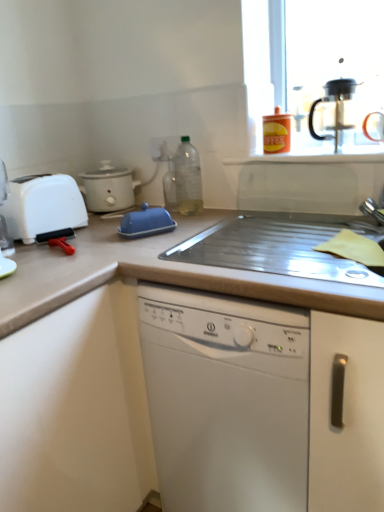
Question: Can beige laminate countertop at center, which is the 1th countertop in bottom-to-top order, be found inside black plastic coffee machine at upper right?

Choices:
 (A) no
 (B) yes

Answer: (A)

Question: Can you confirm if black plastic coffee machine at upper right is positioned to the left of beige laminate countertop at center, which appears as the 2th countertop when viewed from the top?

Choices:
 (A) no
 (B) yes

Answer: (A)

Question: Does black plastic coffee machine at upper right have a larger size compared to beige laminate countertop at center, which appears as the 2th countertop when viewed from the top?

Choices:
 (A) yes
 (B) no

Answer: (B)

Question: Can you confirm if black plastic coffee machine at upper right is shorter than beige laminate countertop at center, which is the 1th countertop in bottom-to-top order?

Choices:
 (A) yes
 (B) no

Answer: (A)

Question: Does black plastic coffee machine at upper right appear on the right side of beige laminate countertop at center, which is the 1th countertop in bottom-to-top order?

Choices:
 (A) no
 (B) yes

Answer: (B)

Question: Considering the positions of point (125, 170) and point (135, 269), is point (125, 170) closer or farther from the camera than point (135, 269)?

Choices:
 (A) closer
 (B) farther

Answer: (B)

Question: In the image, is white matte slow cooker at left, marked as the first kitchen appliance in a back-to-front arrangement, positioned in front of or behind metallic silver sink at center, which is the 2th countertop in bottom-to-top order?

Choices:
 (A) behind
 (B) front

Answer: (A)

Question: From the image's perspective, is white matte slow cooker at left, which ranks as the first kitchen appliance in left-to-right order, positioned above or below metallic silver sink at center, acting as the 1th countertop starting from the top?

Choices:
 (A) below
 (B) above

Answer: (B)

Question: Considering the positions of white matte slow cooker at left, the third kitchen appliance viewed from the right, and metallic silver sink at center, which is the 2th countertop in bottom-to-top order, in the image, is white matte slow cooker at left, the third kitchen appliance viewed from the right, wider or thinner than metallic silver sink at center, which is the 2th countertop in bottom-to-top order,?

Choices:
 (A) thin
 (B) wide

Answer: (A)

Question: Is white matte cabinet at lower left situated inside orange matte coffee canister at upper right, which appears as the 2th kitchen appliance when viewed from the back, or outside?

Choices:
 (A) inside
 (B) outside

Answer: (B)

Question: Relative to orange matte coffee canister at upper right, the 1th kitchen appliance from the right, is white matte cabinet at lower left in front or behind?

Choices:
 (A) behind
 (B) front

Answer: (B)

Question: In terms of width, does white matte cabinet at lower left look wider or thinner when compared to orange matte coffee canister at upper right, the 1th kitchen appliance from the right?

Choices:
 (A) thin
 (B) wide

Answer: (B)

Question: Considering the positions of white matte cabinet at lower left and orange matte coffee canister at upper right, which appears as the 2th kitchen appliance when viewed from the back, in the image, is white matte cabinet at lower left taller or shorter than orange matte coffee canister at upper right, which appears as the 2th kitchen appliance when viewed from the back,?

Choices:
 (A) tall
 (B) short

Answer: (A)

Question: In terms of height, does black plastic coffee machine at upper right look taller or shorter compared to white matte slow cooker at left, the third kitchen appliance viewed from the right?

Choices:
 (A) short
 (B) tall

Answer: (B)

Question: From a real-world perspective, is black plastic coffee machine at upper right above or below white matte slow cooker at left, marked as the first kitchen appliance in a back-to-front arrangement?

Choices:
 (A) above
 (B) below

Answer: (A)